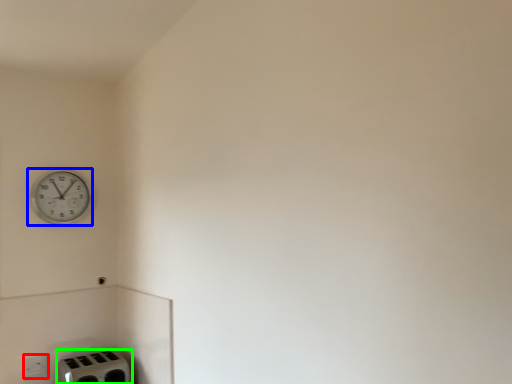
Question: Considering the real-world distances, which object is closest to electric outlet (highlighted by a red box)? wall clock (highlighted by a blue box) or appliance (highlighted by a green box).

Choices:
 (A) wall clock
 (B) appliance

Answer: (B)